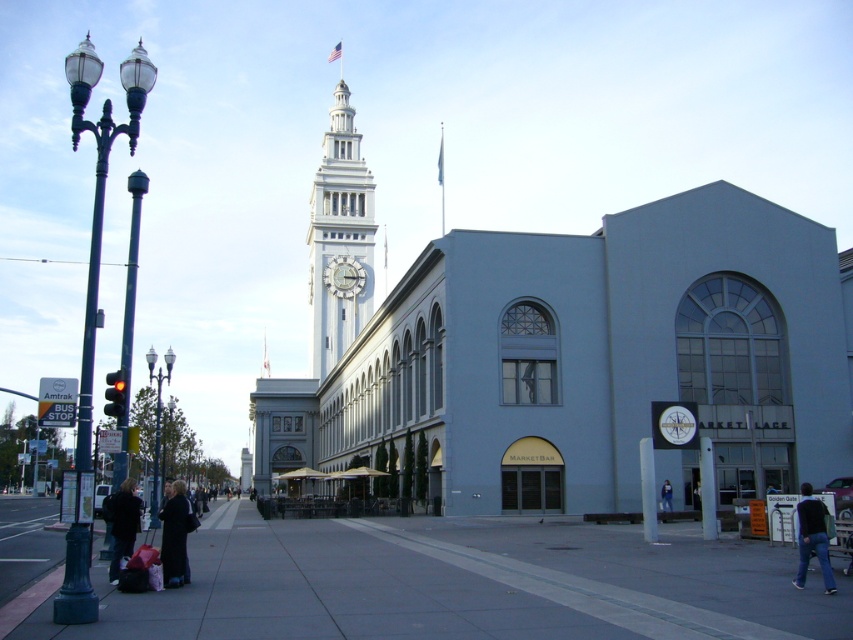
How far apart are dark gray jacket at lower left and denim jacket at lower right?

The distance of dark gray jacket at lower left from denim jacket at lower right is 35.17 meters.

Can you confirm if dark gray jacket at lower left is wider than denim jacket at lower right?

Yes.

Image resolution: width=853 pixels, height=640 pixels. What do you see at coordinates (122, 524) in the screenshot?
I see `dark gray jacket at lower left` at bounding box center [122, 524].

This screenshot has width=853, height=640. I want to click on dark gray jacket at lower left, so click(x=122, y=524).

Who is positioned more to the left, green painted metal streetlight at left or metallic silver clock at center?

green painted metal streetlight at left is more to the left.

Does green painted metal streetlight at left have a larger size compared to metallic silver clock at center?

Indeed, green painted metal streetlight at left has a larger size compared to metallic silver clock at center.

You are a GUI agent. You are given a task and a screenshot of the screen. Output one action in this format:
    pyautogui.click(x=<x>, y=<y>)
    Task: Click on the green painted metal streetlight at left
    
    Given the screenshot: What is the action you would take?
    pyautogui.click(x=100, y=192)

Who is more forward, [170,548] or [349,285]?

Point [170,548] is in front.

Which of these two, dark gray coat at lower left or metallic silver clock at center, stands shorter?

dark gray coat at lower left

I want to click on dark gray coat at lower left, so [x=175, y=536].